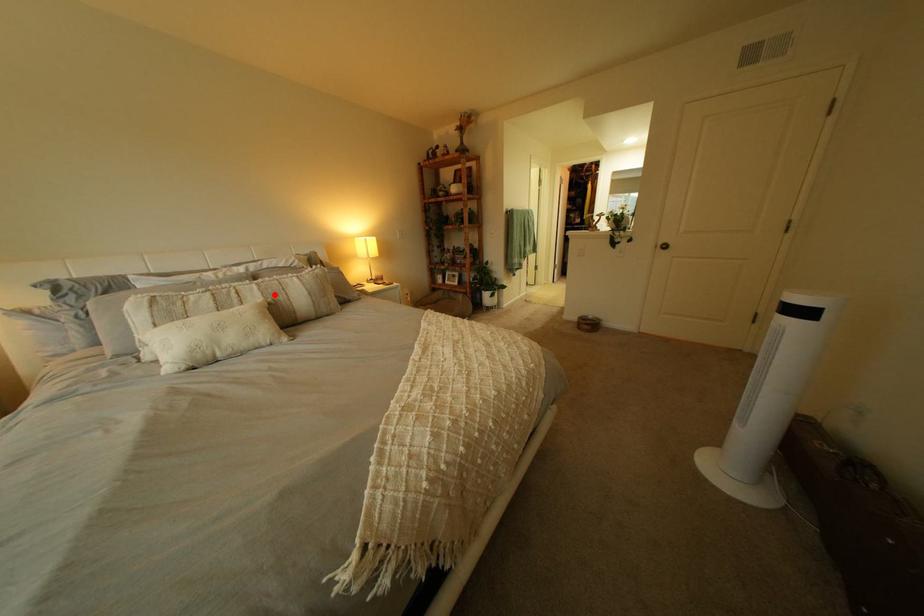
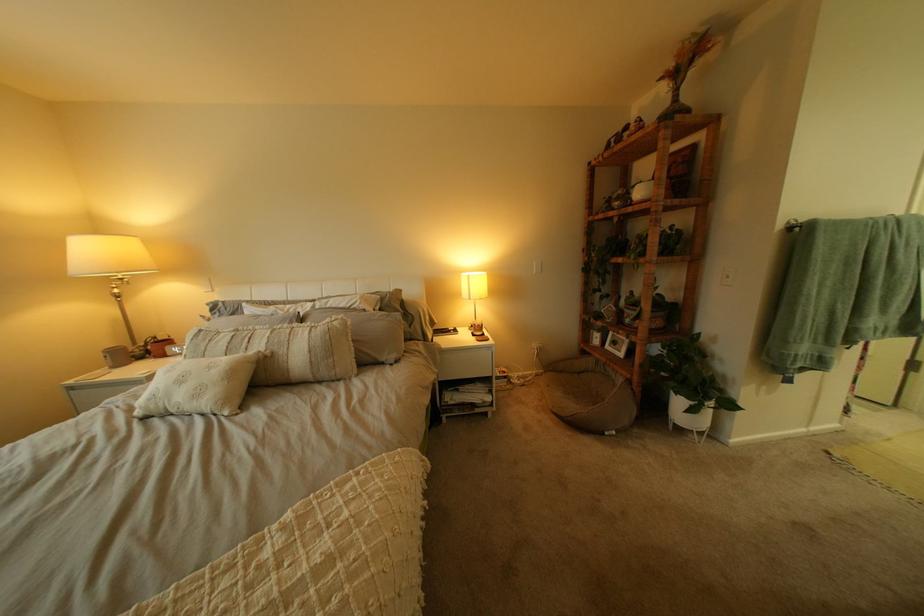
Find the pixel in the second image that matches the highlighted location in the first image.

(281, 342)